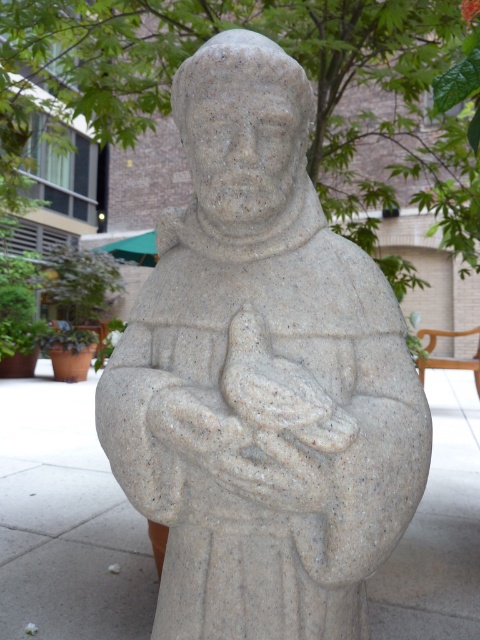
Question: Which point appears closest to the camera in this image?

Choices:
 (A) (348, 465)
 (B) (414, 616)

Answer: (A)

Question: From the image, what is the correct spatial relationship of granite statue at center in relation to smooth stone statue at center?

Choices:
 (A) above
 (B) below

Answer: (A)

Question: Which of the following is the farthest from the observer?

Choices:
 (A) smooth stone statue at center
 (B) granite statue at center

Answer: (A)

Question: Is granite statue at center bigger than smooth stone statue at center?

Choices:
 (A) no
 (B) yes

Answer: (A)

Question: Can you confirm if granite statue at center is wider than smooth stone statue at center?

Choices:
 (A) yes
 (B) no

Answer: (B)